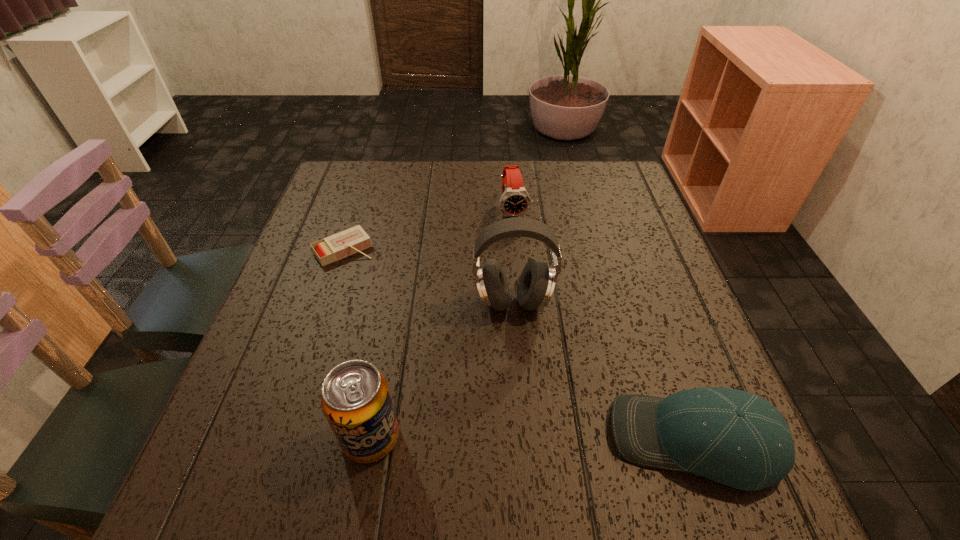
Where is `soda can`? soda can is located at coordinates (356, 401).

I want to click on the second object from left to right, so click(356, 401).

Find the location of a particular element. The height and width of the screenshot is (540, 960). baseball cap is located at coordinates (733, 437).

In order to click on the rightmost object in this screenshot , I will do `click(733, 437)`.

At what (x,y) coordinates should I click in order to perform the action: click on the shortest object. Please return your answer as a coordinate pair (x, y). Looking at the image, I should click on (330, 249).

Where is `the second farthest object`? the second farthest object is located at coordinates (330, 249).

Where is `watch`? watch is located at coordinates (515, 201).

Where is `the farthest object`? This screenshot has width=960, height=540. the farthest object is located at coordinates (515, 201).

Find the location of a particular element. This screenshot has height=540, width=960. the tallest object is located at coordinates (537, 281).

Identify the location of the third nearest object. The image size is (960, 540). (537, 281).